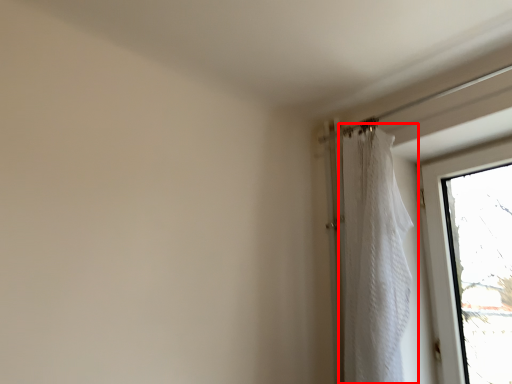
Question: Observing the image, what is the correct spatial positioning of curtain (annotated by the red box) in reference to window?

Choices:
 (A) left
 (B) right

Answer: (A)